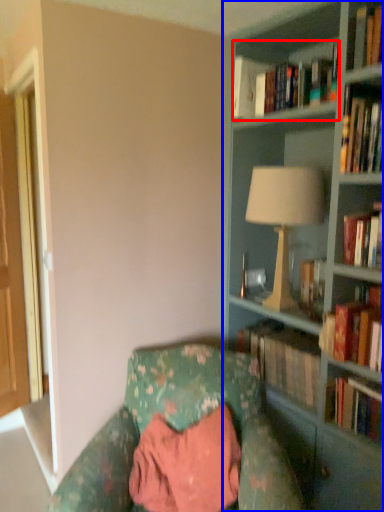
Question: Which point is closer to the camera, book (highlighted by a red box) or bookcase (highlighted by a blue box)?

Choices:
 (A) book
 (B) bookcase

Answer: (B)